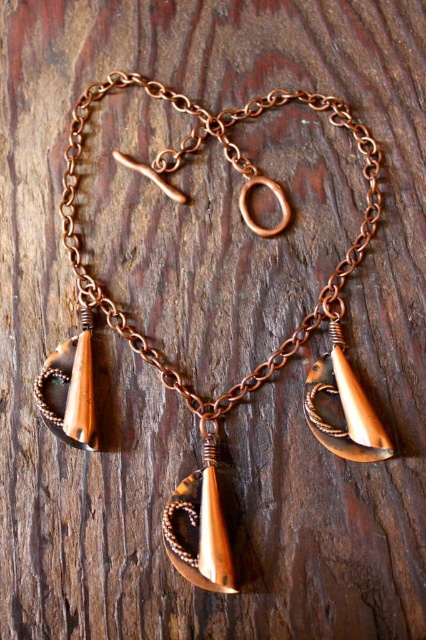
Consider the image. Looking at the necklace against the rustic wooden background, which pendant is wider between the copper wire wrapped pendant at center and the matte copper pendant at lower right?

The copper wire wrapped pendant at center is wider than the matte copper pendant at lower right.

You are a jeweler who wants to adjust the length of the necklace so that the copper wire wrapped pendant at center is closer to the wearer. How much shorter should you make the necklace?

The copper wire wrapped pendant at center is currently 1.20 meters away from the desired position, so you should shorten the necklace by 1.20 meters to bring it closer.